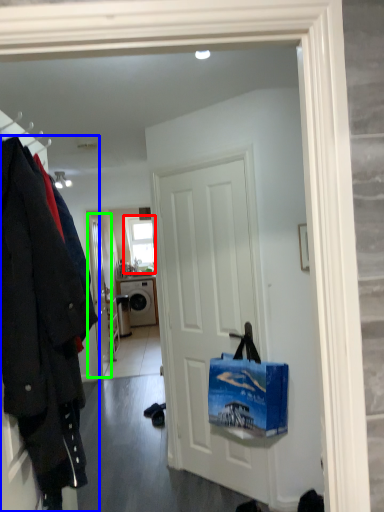
Question: Considering the real-world distances, which object is closest to window (highlighted by a red box)? coat (highlighted by a blue box) or door (highlighted by a green box).

Choices:
 (A) coat
 (B) door

Answer: (B)